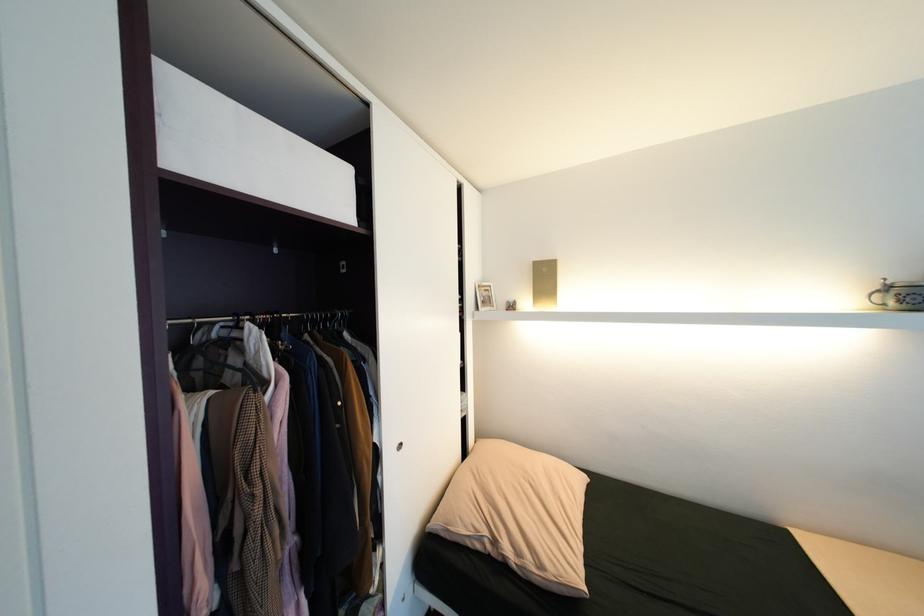
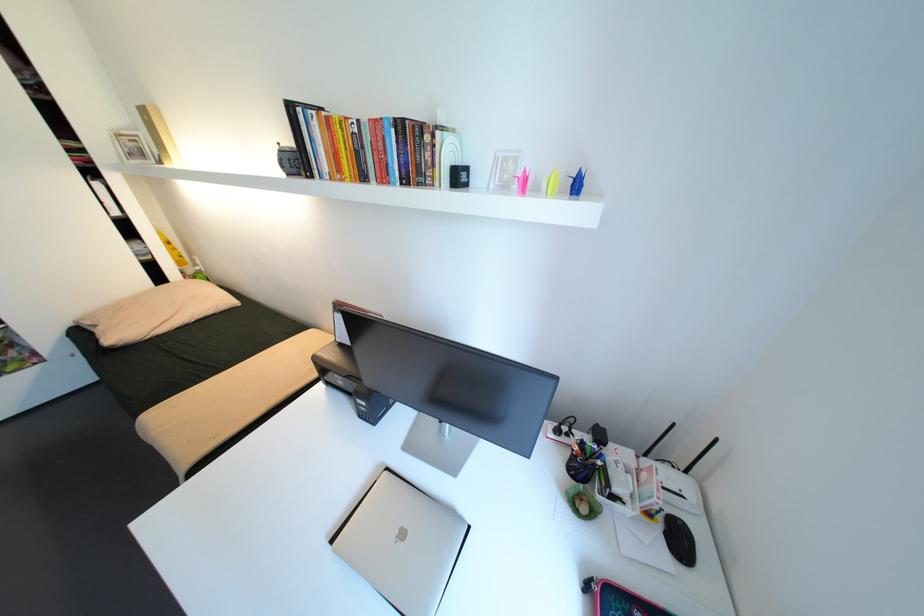
Question: The images are taken continuously from a first-person perspective. In which direction are you moving?

Choices:
 (A) Left
 (B) Right
 (C) Forward
 (D) Backward

Answer: (B)